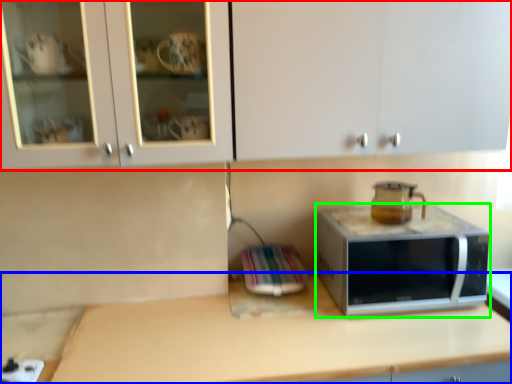
Question: Considering the real-world distances, which object is farthest from cabinetry (highlighted by a red box)? countertop (highlighted by a blue box) or microwave oven (highlighted by a green box)?

Choices:
 (A) countertop
 (B) microwave oven

Answer: (A)